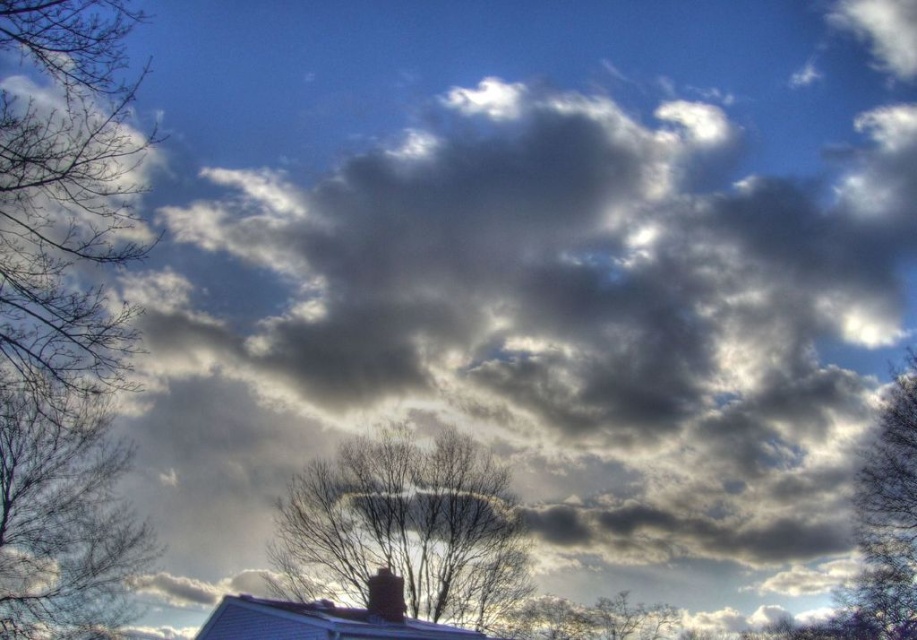
Does bare branches at left have a greater height compared to bare branches at center?

Indeed, bare branches at left has a greater height compared to bare branches at center.

Who is shorter, bare branches at left or bare branches at center?

With less height is bare branches at center.

Who is more forward, (118,227) or (436,520)?

Point (118,227)

Locate an element on the screen. This screenshot has height=640, width=917. bare branches at left is located at coordinates (65, 317).

This screenshot has height=640, width=917. What do you see at coordinates (887, 522) in the screenshot? I see `smooth bark tree at right` at bounding box center [887, 522].

This screenshot has height=640, width=917. I want to click on smooth bark tree at right, so click(887, 522).

Is bare branches at center in front of smooth bark tree at right?

Yes, it is.

This screenshot has height=640, width=917. Identify the location of bare branches at center. (407, 528).

Between point (363, 477) and point (882, 588), which one is positioned in front?

Point (363, 477)

Where is `bare branches at center`? bare branches at center is located at coordinates (407, 528).